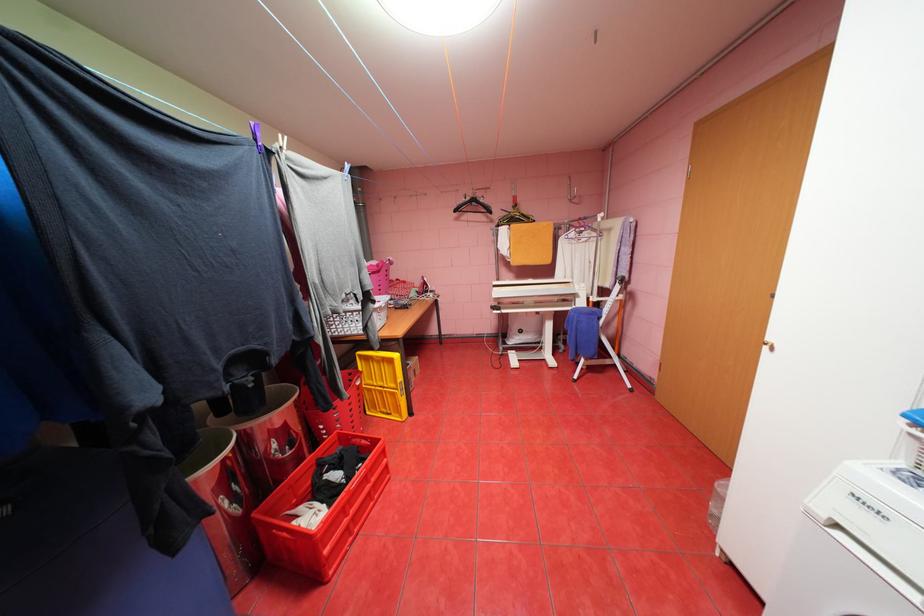
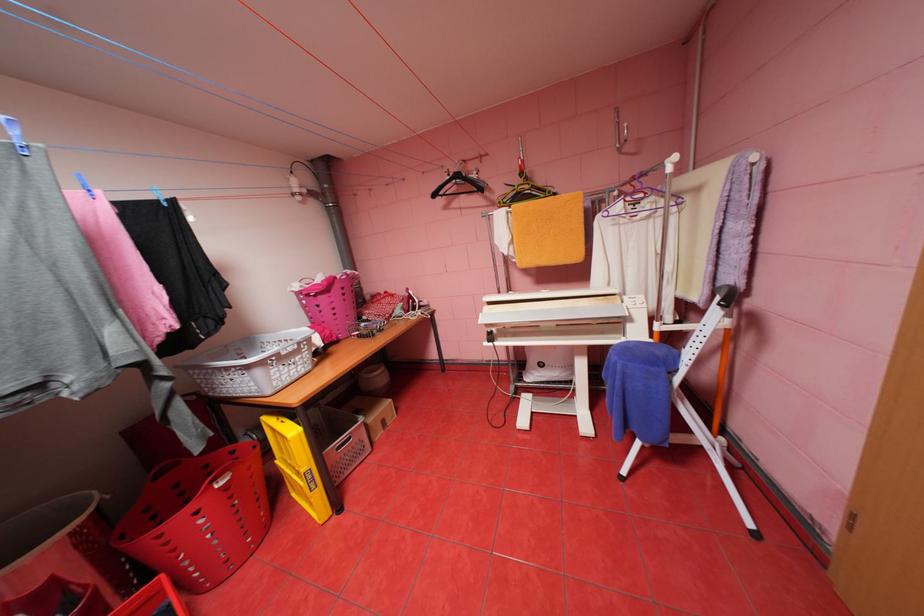
Which direction would the cameraman need to move to produce the second image?

The cameraman moved toward right, forward.